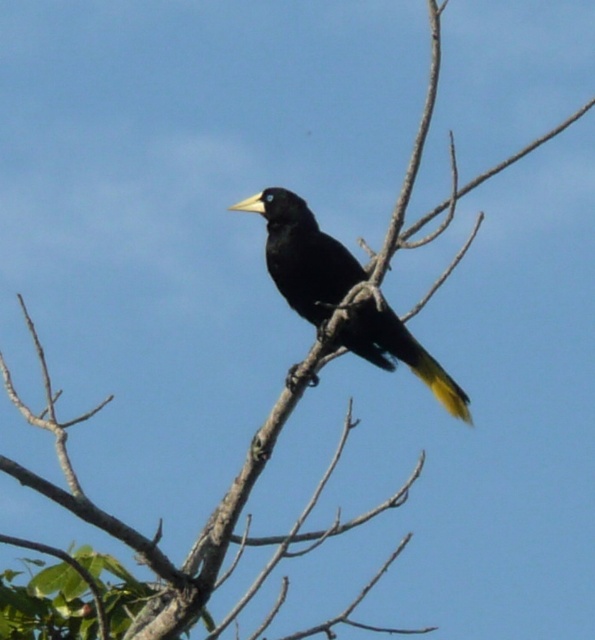
Question: In this image, where is black glossy bird at center located relative to yellow matte tail at center?

Choices:
 (A) below
 (B) above

Answer: (B)

Question: Can you confirm if black glossy bird at center is positioned below yellow matte tail at center?

Choices:
 (A) yes
 (B) no

Answer: (B)

Question: Can you confirm if black glossy bird at center is bigger than yellow matte tail at center?

Choices:
 (A) no
 (B) yes

Answer: (B)

Question: Among these objects, which one is nearest to the camera?

Choices:
 (A) black glossy bird at center
 (B) yellow matte tail at center

Answer: (A)

Question: Which of the following is the closest to the observer?

Choices:
 (A) yellow matte tail at center
 (B) black glossy bird at center

Answer: (B)